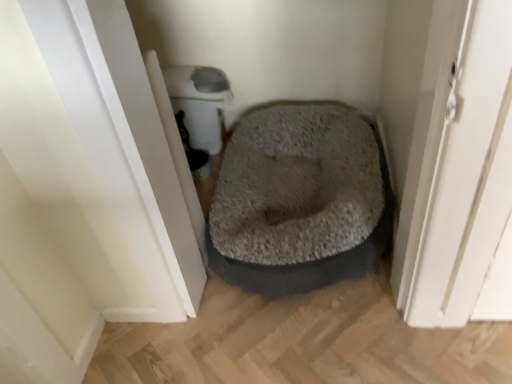
The width and height of the screenshot is (512, 384). What are the coordinates of `white glossy screen door at left` in the screenshot? It's located at (147, 140).

What do you see at coordinates (147, 140) in the screenshot? I see `white glossy screen door at left` at bounding box center [147, 140].

What do you see at coordinates (298, 200) in the screenshot?
I see `gray plush dog bed at center` at bounding box center [298, 200].

In order to face gray plush dog bed at center, should I rotate leftwards or rightwards?

A 4.693 degree turn to the right will do.

Where is `gray plush dog bed at center`? This screenshot has height=384, width=512. gray plush dog bed at center is located at coordinates (298, 200).

What is the approximate width of gray plush dog bed at center?

21.84 inches.

Measure the distance between gray plush dog bed at center and camera.

The depth of gray plush dog bed at center is 1.19 meters.

Find the location of a particular element. The image size is (512, 384). white glossy screen door at left is located at coordinates (147, 140).

Is white glossy screen door at left at the right side of gray plush dog bed at center?

No.

Is white glossy screen door at left in front of gray plush dog bed at center?

Yes, white glossy screen door at left is in front of gray plush dog bed at center.

Is point (111, 108) farther from camera compared to point (238, 248)?

That is False.

Based on the photo, from the image's perspective, between white glossy screen door at left and gray plush dog bed at center, who is located below?

gray plush dog bed at center appears lower in the image.

From a real-world perspective, is white glossy screen door at left positioned over gray plush dog bed at center based on gravity?

Indeed, from a real-world perspective, white glossy screen door at left stands above gray plush dog bed at center.

Is white glossy screen door at left thinner than gray plush dog bed at center?

Yes, white glossy screen door at left is thinner than gray plush dog bed at center.

Can you confirm if white glossy screen door at left is shorter than gray plush dog bed at center?

No.

Considering the sizes of objects white glossy screen door at left and gray plush dog bed at center in the image provided, who is bigger, white glossy screen door at left or gray plush dog bed at center?

gray plush dog bed at center is bigger.

Would you say white glossy screen door at left is inside or outside gray plush dog bed at center?

white glossy screen door at left exists outside the volume of gray plush dog bed at center.

Is white glossy screen door at left next to gray plush dog bed at center and touching it?

They are not placed beside each other.

Is gray plush dog bed at center at the back of white glossy screen door at left?

white glossy screen door at left does not have its back to gray plush dog bed at center.

How different are the orientations of white glossy screen door at left and gray plush dog bed at center in degrees?

They differ by 180 degrees in their facing directions.

Where is `screen door above the gray plush dog bed at center (from the image's perspective)`? screen door above the gray plush dog bed at center (from the image's perspective) is located at coordinates (147, 140).

Between gray plush dog bed at center and white glossy screen door at left, which one appears on the right side from the viewer's perspective?

gray plush dog bed at center.

Which is in front, gray plush dog bed at center or white glossy screen door at left?

white glossy screen door at left is in front.

Between point (298, 222) and point (89, 56), which one is positioned in front?

The point (89, 56) is closer to the camera.

From the image's perspective, which is above, gray plush dog bed at center or white glossy screen door at left?

white glossy screen door at left, from the image's perspective.

From a real-world perspective, is gray plush dog bed at center positioned above or below white glossy screen door at left?

Clearly, from a real-world perspective, gray plush dog bed at center is below white glossy screen door at left.

Considering the sizes of objects gray plush dog bed at center and white glossy screen door at left in the image provided, who is thinner, gray plush dog bed at center or white glossy screen door at left?

white glossy screen door at left.

Is gray plush dog bed at center taller than white glossy screen door at left?

No.

Can you confirm if gray plush dog bed at center is smaller than white glossy screen door at left?

No, gray plush dog bed at center is not smaller than white glossy screen door at left.

Is gray plush dog bed at center situated inside white glossy screen door at left or outside?

gray plush dog bed at center is outside white glossy screen door at left.

Are gray plush dog bed at center and white glossy screen door at left far apart?

gray plush dog bed at center is actually quite close to white glossy screen door at left.

Could you tell me if gray plush dog bed at center is turned towards white glossy screen door at left?

No, gray plush dog bed at center is not turned towards white glossy screen door at left.

The width and height of the screenshot is (512, 384). I want to click on screen door on the left of the gray plush dog bed at center, so click(147, 140).

Find the location of a particular element. screen door above the gray plush dog bed at center (from a real-world perspective) is located at coordinates (147, 140).

The height and width of the screenshot is (384, 512). I want to click on screen door that is in front of the gray plush dog bed at center, so click(147, 140).